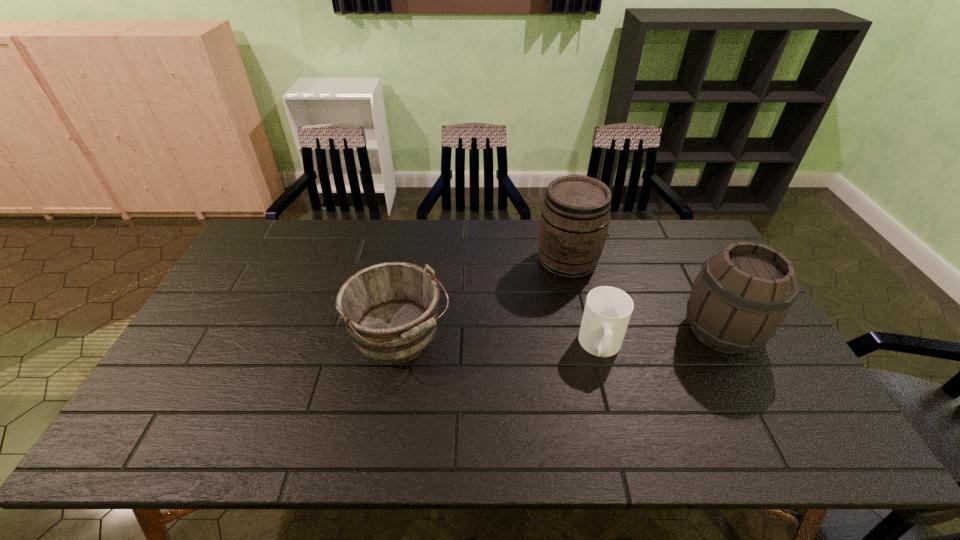
Locate an element on the screen. This screenshot has height=540, width=960. the farthest object is located at coordinates tap(574, 222).

You are a GUI agent. You are given a task and a screenshot of the screen. Output one action in this format:
    pyautogui.click(x=<x>, y=<y>)
    Task: Click on the farthest wine bucket
    
    Given the screenshot: What is the action you would take?
    pyautogui.click(x=574, y=222)

Locate an element on the screen. The image size is (960, 540). the rightmost wine bucket is located at coordinates (743, 293).

This screenshot has width=960, height=540. Identify the location of the leftmost object. (390, 310).

At what (x,y) coordinates should I click in order to perform the action: click on the shortest wine bucket. Please return your answer as a coordinate pair (x, y). This screenshot has height=540, width=960. Looking at the image, I should click on (390, 310).

Find the location of `mug`. mug is located at coordinates coord(607,312).

Image resolution: width=960 pixels, height=540 pixels. I want to click on vacant space located on the left of the second wine bucket from left to right, so click(430, 262).

Find the location of a particular element. This screenshot has height=540, width=960. vacant area situated 0.350m on the back of the rightmost object is located at coordinates (669, 234).

Locate an element on the screen. Image resolution: width=960 pixels, height=540 pixels. vacant region located 0.090m on the back of the leftmost wine bucket is located at coordinates (409, 279).

This screenshot has width=960, height=540. Find the location of `free space located on the handle side of the mug`. free space located on the handle side of the mug is located at coordinates (614, 396).